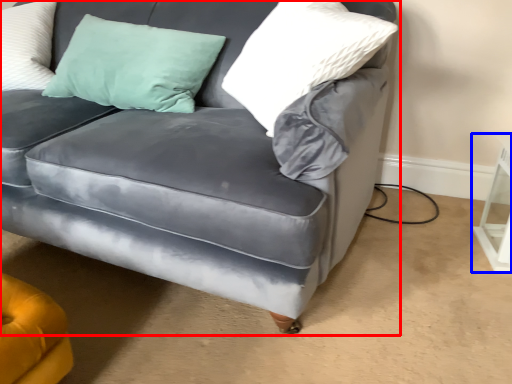
Question: Which object appears farthest to the camera in this image, studio couch (highlighted by a red box) or table (highlighted by a blue box)?

Choices:
 (A) studio couch
 (B) table

Answer: (B)